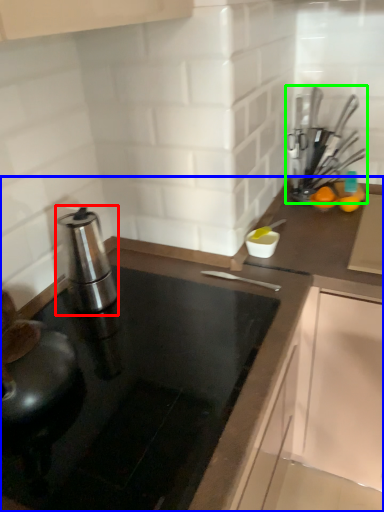
Question: Which object is the farthest from kitchen appliance (highlighted by a red box)? Choose among these: countertop (highlighted by a blue box) or kitchen appliance (highlighted by a green box).

Choices:
 (A) countertop
 (B) kitchen appliance

Answer: (B)